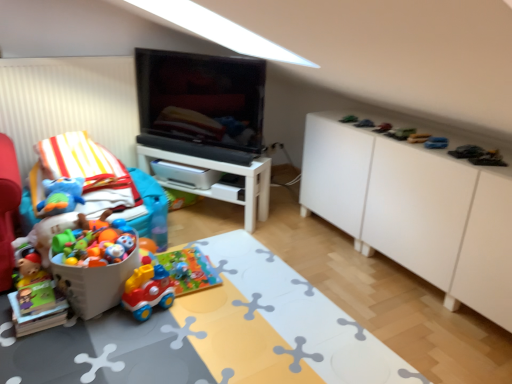
Locate an element on the screen. vacant space positioned to the left of white matte cabinet at right is located at coordinates (309, 246).